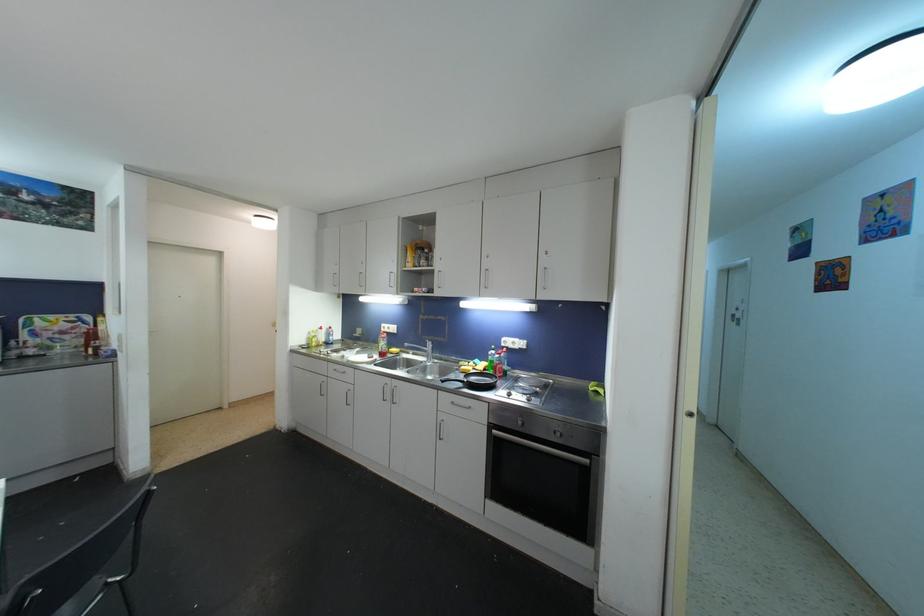
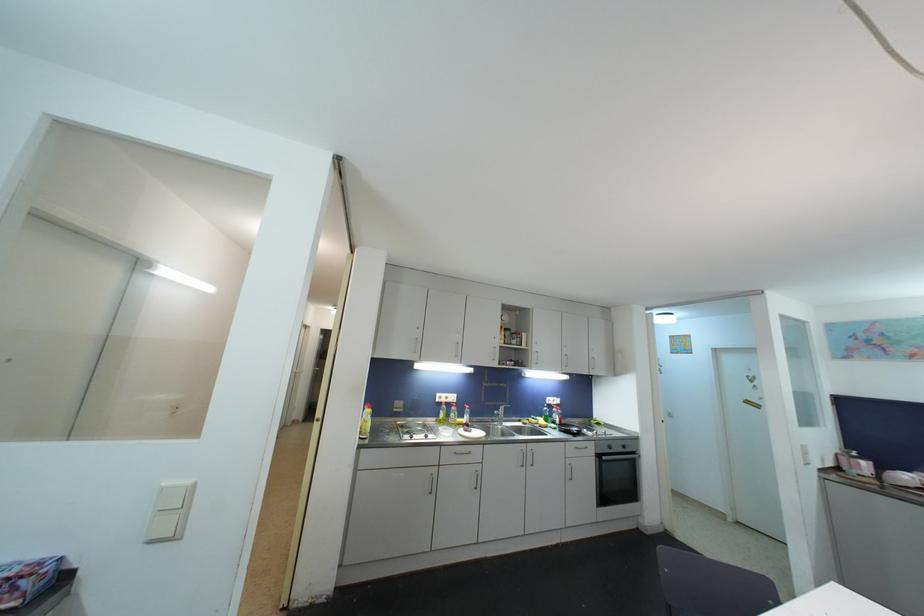
Find the pixel in the second image that matches [392,331] in the first image.

(450, 400)